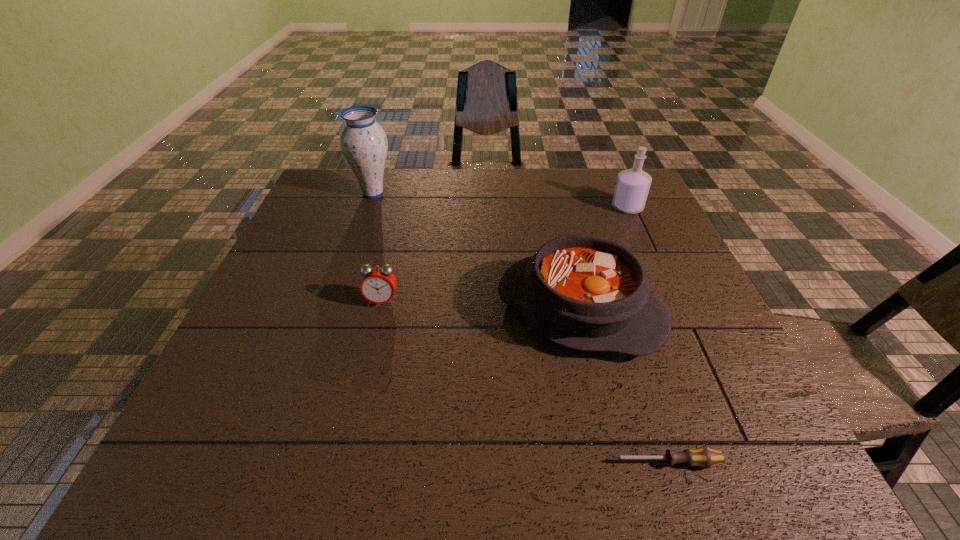
At what (x,y) coordinates should I click in order to perform the action: click on free space between the casserole and the second shortest object. Please return your answer as a coordinate pair (x, y). Looking at the image, I should click on (481, 305).

Find the location of a particular element. free space between the nearest object and the third shortest object is located at coordinates (623, 386).

The width and height of the screenshot is (960, 540). Identify the location of unoccupied position between the screwdriver and the alarm clock. (524, 382).

I want to click on vacant space that is in between the tallest object and the shortest object, so click(520, 328).

At what (x,y) coordinates should I click in order to perform the action: click on free space between the tallest object and the second tallest object. Please return your answer as a coordinate pair (x, y). The height and width of the screenshot is (540, 960). Looking at the image, I should click on (500, 201).

Where is `free point between the third tallest object and the second shortest object`? The height and width of the screenshot is (540, 960). free point between the third tallest object and the second shortest object is located at coordinates (481, 305).

This screenshot has height=540, width=960. What are the coordinates of `vacant area between the second shortest object and the screwdriver` in the screenshot? It's located at (524, 382).

Locate an element on the screen. The width and height of the screenshot is (960, 540). vacant area that lies between the fourth tallest object and the casserole is located at coordinates (481, 305).

Find the location of a particular element. This screenshot has height=540, width=960. object that is the second closest to the tallest object is located at coordinates (584, 292).

Identify which object is the closest to the shortest object. Please provide its 2D coordinates. Your answer should be formatted as a tuple, i.e. [(x, y)], where the tuple contains the x and y coordinates of a point satisfying the conditions above.

[(584, 292)]